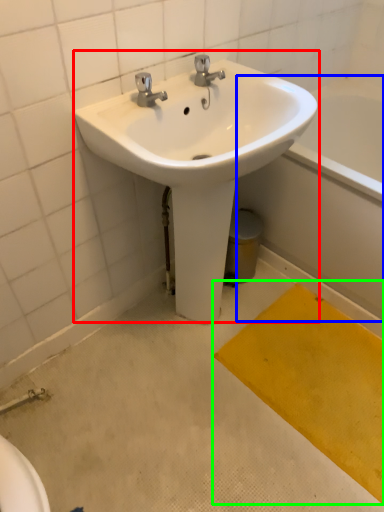
Question: Which object is positioned closest to sink (highlighted by a red box)? Select from bath (highlighted by a blue box) and doormat (highlighted by a green box).

Choices:
 (A) bath
 (B) doormat

Answer: (A)